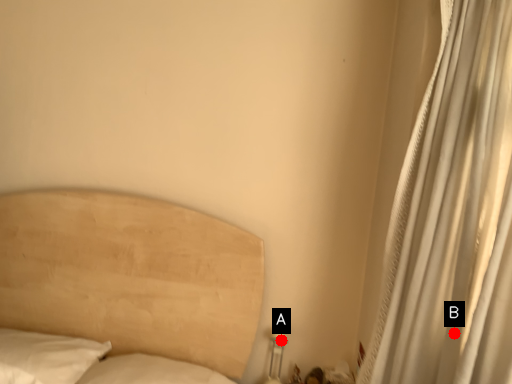
Question: Two points are circled on the image, labeled by A and B beside each circle. Which point is farther to the camera?

Choices:
 (A) A is further
 (B) B is further

Answer: (A)